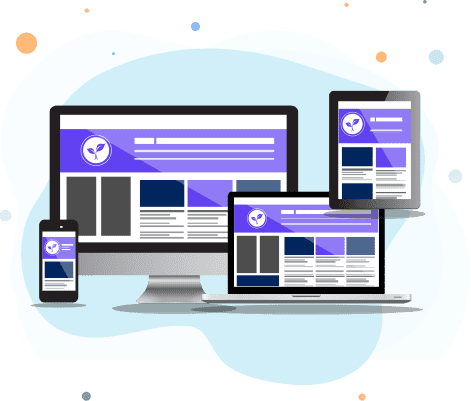
Identify the location of mockup of a laptop. (298, 237).